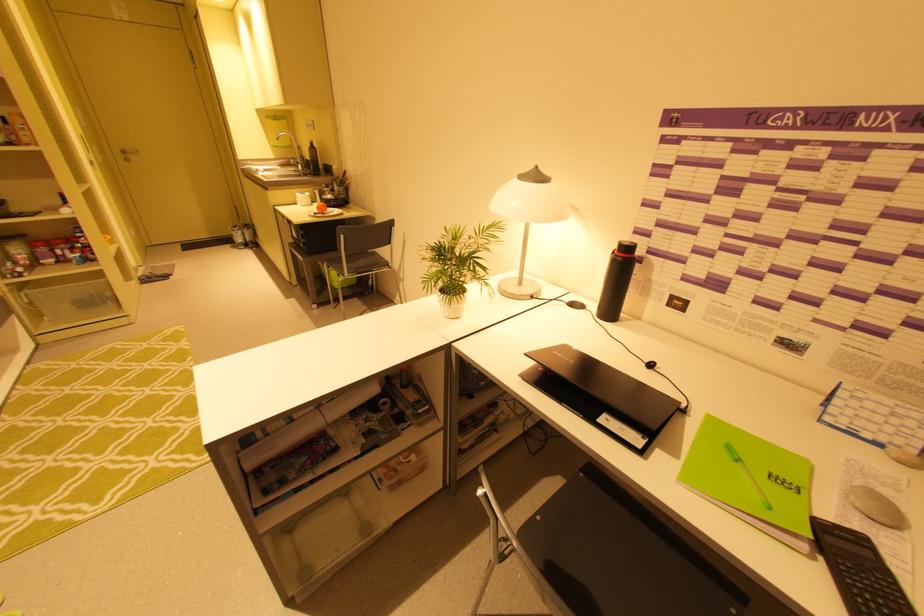
The height and width of the screenshot is (616, 924). I want to click on faucet handle, so click(295, 161).